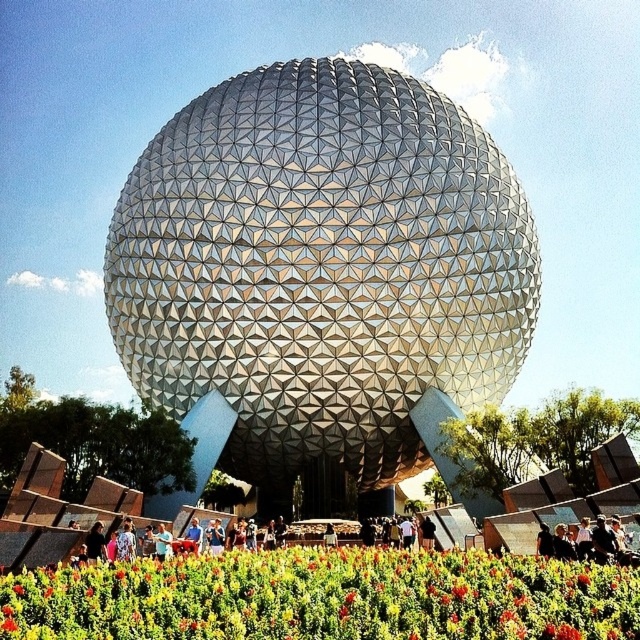
You are a drone operator tasked with flying a drone between the metallic sphere at center and the vibrant floral carpet at center. The drone has a wingspan of 18 inches. Can the drone safely pass through the space between them?

The distance between the metallic sphere at center and vibrant floral carpet at center is 19.05 inches. Since the drone has a wingspan of 18 inches, it can safely pass through the space between them as the available space is slightly larger than the drone.

You are an architect planning to place a new sculpture in the garden in front of the white textured sphere at center and the metallic sphere at center. Which sphere should the sculpture be placed closer to if you want it to appear proportionally smaller in comparison?

The sculpture should be placed closer to the white textured sphere at center because it is larger, making the sculpture appear proportionally smaller in comparison.